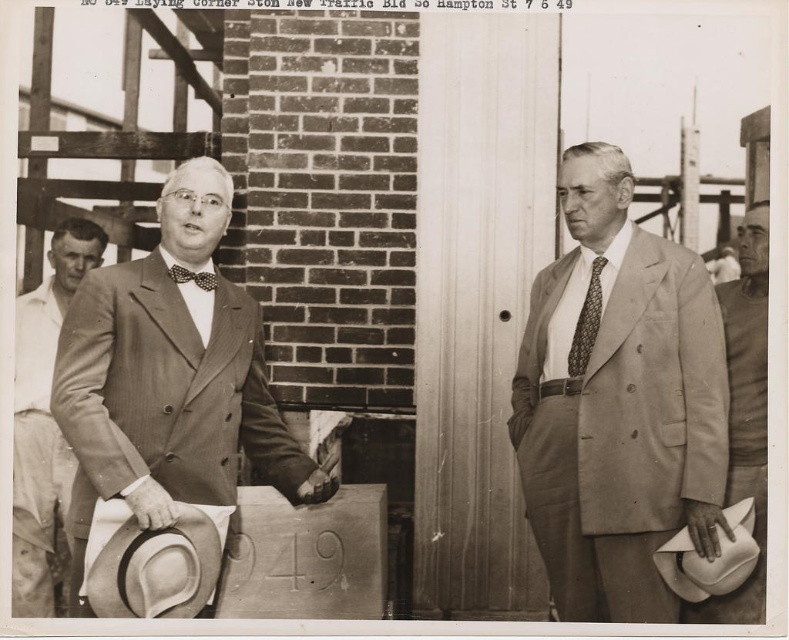
You are a photographer reviewing this historical image. You notice the light brown suit at left and the light beige felt hat at lower left. Based on their positions, which object is closer to the right edge of the image?

The light brown suit at left is to the right of the light beige felt hat at lower left, so the light brown suit at left is closer to the right edge of the image.

You are a photographer reviewing this historical image. You notice the light brown suit at left and the light beige felt hat at lower left. Which object is positioned higher in the image?

The light brown suit at left is located above the light beige felt hat at lower left, so it is positioned higher in the image.